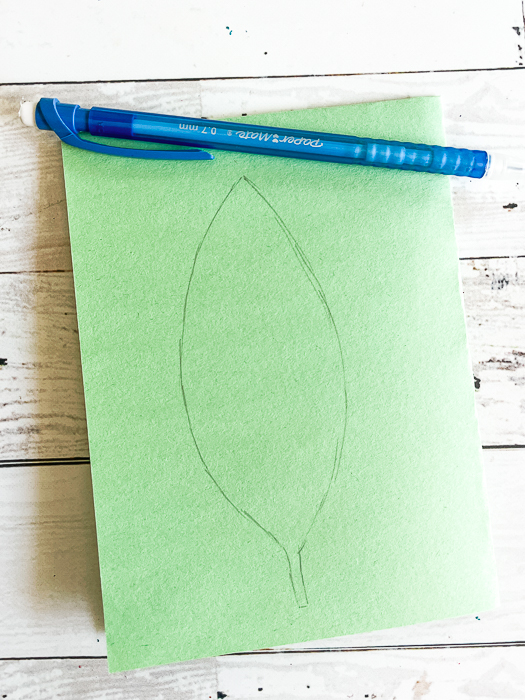
At what (x,y) coordinates should I click in order to perform the action: click on wood table. Please return your answer as a coordinate pair (x, y). Image resolution: width=525 pixels, height=700 pixels. Looking at the image, I should click on (68, 615).